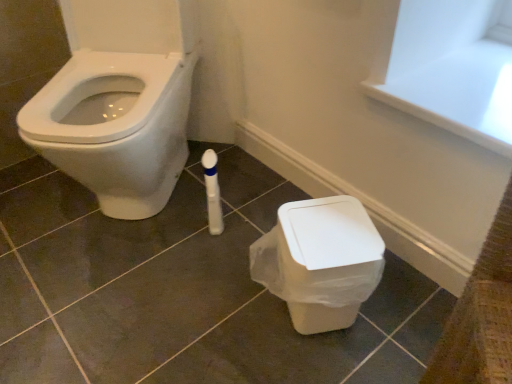
Question: In terms of height, does white glossy bidet at left look taller or shorter compared to white plastic bin at lower right?

Choices:
 (A) tall
 (B) short

Answer: (A)

Question: Would you say white glossy bidet at left is to the left or to the right of white plastic bin at lower right in the picture?

Choices:
 (A) left
 (B) right

Answer: (A)

Question: Based on their relative distances, which object is farther from the white glossy bidet at left?

Choices:
 (A) matte white tile at center
 (B) white plastic bin at lower right

Answer: (B)

Question: Based on their relative distances, which object is nearer to the white plastic bin at lower right?

Choices:
 (A) white glossy bidet at left
 (B) matte white tile at center

Answer: (B)